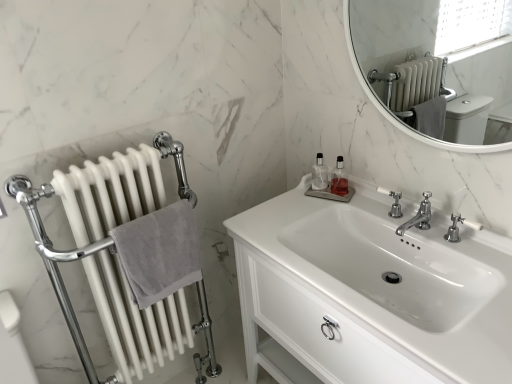
I want to click on vacant area that lies between clear glass bottle at upper center, the first toiletry when ordered from right to left, and polished chrome faucet at center, the 2th tap when ordered from right to left, so (x=369, y=215).